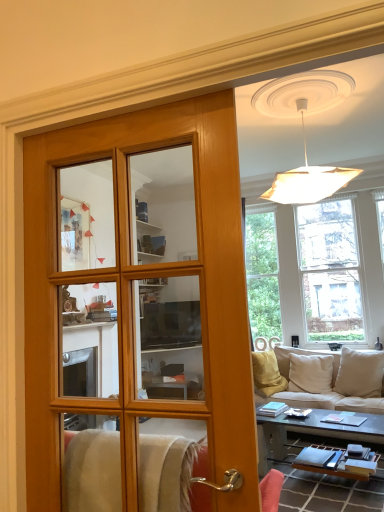
Question: Is smooth black coffee table at lower right in front of or behind clear glass window at upper right in the image?

Choices:
 (A) front
 (B) behind

Answer: (A)

Question: Based on their sizes in the image, would you say smooth black coffee table at lower right is bigger or smaller than clear glass window at upper right?

Choices:
 (A) small
 (B) big

Answer: (A)

Question: Based on their relative distances, which object is nearer to the beige fabric couch at lower right?

Choices:
 (A) wooden door at center
 (B) clear glass window at upper right
 (C) smooth black coffee table at lower right

Answer: (C)

Question: Which is nearer to the wooden door at center?

Choices:
 (A) smooth black coffee table at lower right
 (B) beige fabric couch at lower right
 (C) clear glass window at upper right

Answer: (A)